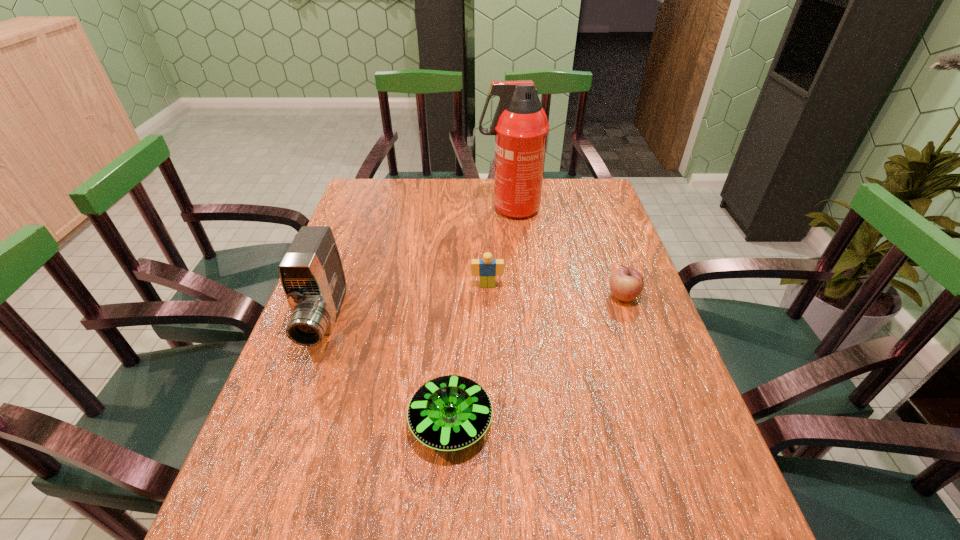
This screenshot has height=540, width=960. What are the coordinates of `fire extinguisher` in the screenshot? It's located at (520, 125).

Where is `the tallest object`? The width and height of the screenshot is (960, 540). the tallest object is located at coordinates (520, 125).

At what (x,y) coordinates should I click in order to perform the action: click on the leftmost object. Please return your answer as a coordinate pair (x, y). This screenshot has height=540, width=960. Looking at the image, I should click on (311, 272).

Find the location of a particular element. camcorder is located at coordinates (311, 272).

Locate an element on the screen. This screenshot has height=540, width=960. Lego is located at coordinates (486, 268).

You are a GUI agent. You are given a task and a screenshot of the screen. Output one action in this format:
    pyautogui.click(x=<x>, y=<y>)
    Task: Click on the apple
    This screenshot has height=540, width=960.
    Given the screenshot: What is the action you would take?
    pyautogui.click(x=626, y=284)

The image size is (960, 540). I want to click on the nearest object, so click(448, 413).

This screenshot has width=960, height=540. I want to click on the shortest object, so click(448, 413).

Image resolution: width=960 pixels, height=540 pixels. What are the coordinates of `free region located 0.300m on the trigger side of the farthest object` in the screenshot? It's located at (390, 209).

Locate an element on the screen. This screenshot has width=960, height=540. vacant region located on the trigger side of the farthest object is located at coordinates (390, 209).